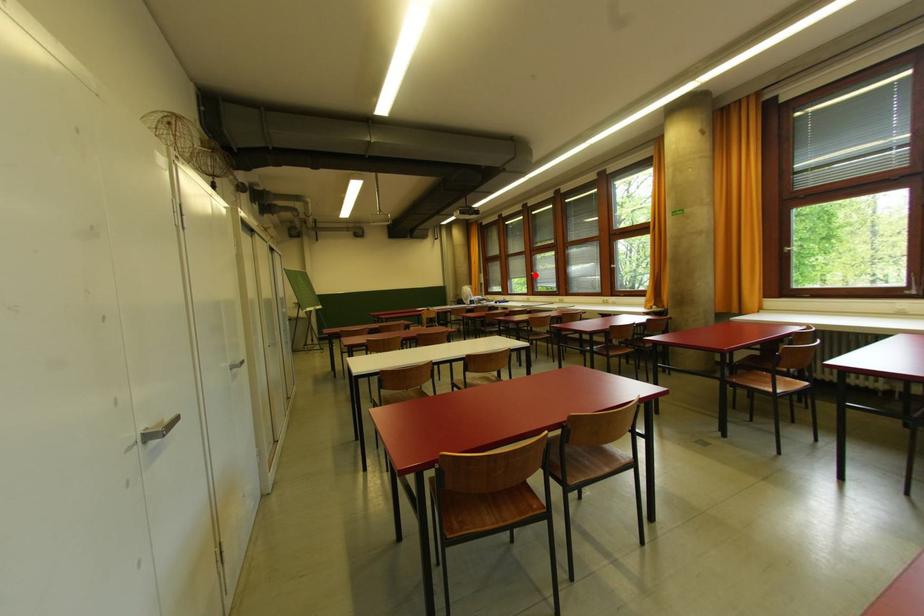
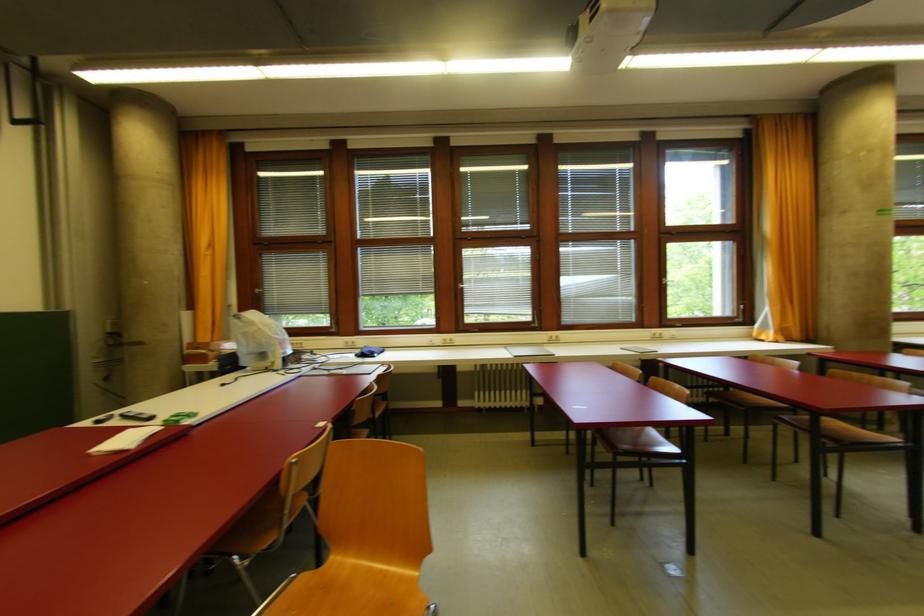
In the second image, find the point that corresponds to the highlighted location in the first image.

(465, 288)